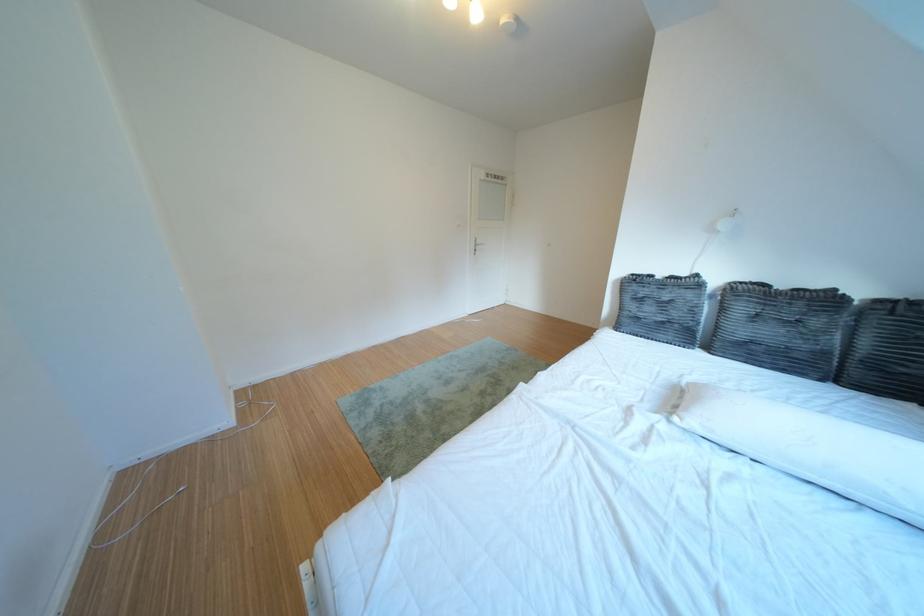
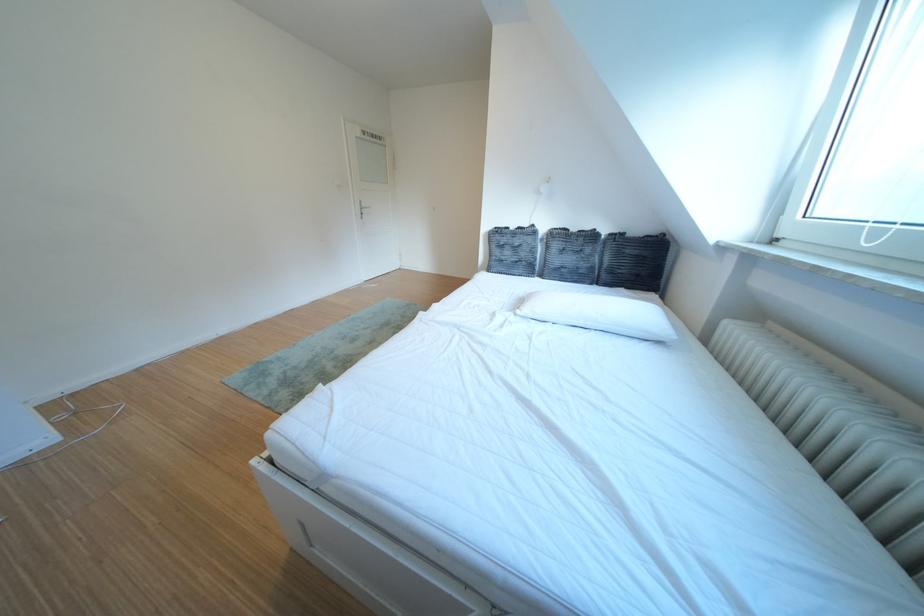
Question: The first image is from the beginning of the video and the second image is from the end. How did the camera likely rotate when shooting the video?

Choices:
 (A) Left
 (B) Right
 (C) Up
 (D) Down

Answer: (B)